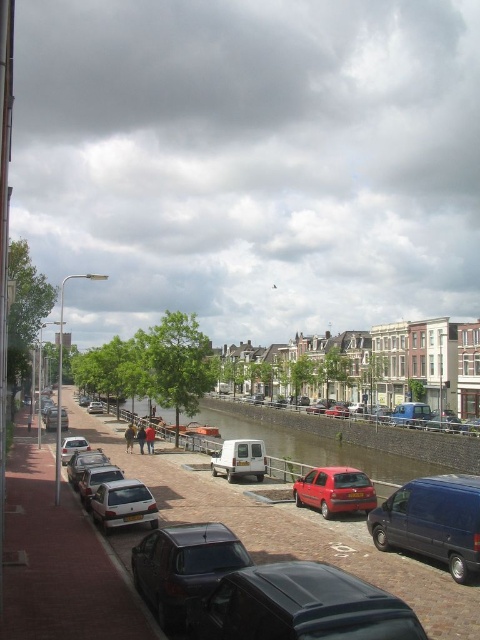
You are a delivery driver who needs to park your vehicle between the silver metallic van at lower left and the silver metallic hatchback at center. Can you fit your 2.5 meter wide truck between them?

The silver metallic van at lower left is positioned on the right side of silver metallic hatchback at center, so there is space between them. However, the distance between the two vehicles is not specified. Without knowing the exact distance, it is impossible to determine if your 2.5 meter wide truck can fit between them.

In the scene shown: You are standing at the center of the cobblestone street in the image. You need to locate the silver metallic van at lower left. In which direction should you look to find it?

You should look to the lower left direction to find the silver metallic van at lower left.